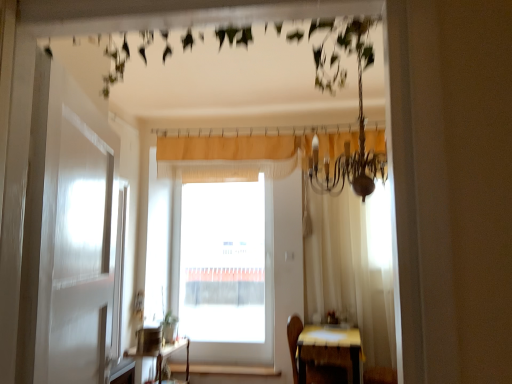
Question: Is transparent glass window at center at the back of wooden at lower center?

Choices:
 (A) yes
 (B) no

Answer: (B)

Question: Is wooden at lower center thinner than transparent glass window at center?

Choices:
 (A) yes
 (B) no

Answer: (B)

Question: From a real-world perspective, is wooden at lower center below transparent glass window at center?

Choices:
 (A) yes
 (B) no

Answer: (A)

Question: Can we say wooden at lower center lies outside transparent glass window at center?

Choices:
 (A) no
 (B) yes

Answer: (B)

Question: Can you confirm if wooden at lower center is smaller than transparent glass window at center?

Choices:
 (A) no
 (B) yes

Answer: (B)

Question: Looking at their shapes, would you say beige textured curtain at center is wider or thinner than wooden table at center, placed as the first table when sorted from left to right?

Choices:
 (A) wide
 (B) thin

Answer: (B)

Question: Is point (370, 144) positioned closer to the camera than point (155, 380)?

Choices:
 (A) farther
 (B) closer

Answer: (B)

Question: Would you say beige textured curtain at center is to the left or to the right of wooden table at center, which appears as the 2th table when viewed from the right, in the picture?

Choices:
 (A) right
 (B) left

Answer: (A)

Question: From a real-world perspective, relative to wooden table at center, which appears as the 2th table when viewed from the right, is beige textured curtain at center vertically above or below?

Choices:
 (A) below
 (B) above

Answer: (B)

Question: Is point (278, 137) positioned closer to the camera than point (245, 370)?

Choices:
 (A) closer
 (B) farther

Answer: (A)

Question: From the image's perspective, is beige textured curtain at center positioned above or below wooden at lower center?

Choices:
 (A) below
 (B) above

Answer: (B)

Question: Which is correct: beige textured curtain at center is inside wooden at lower center, or outside of it?

Choices:
 (A) outside
 (B) inside

Answer: (A)

Question: Considering the positions of beige textured curtain at center and wooden at lower center in the image, is beige textured curtain at center bigger or smaller than wooden at lower center?

Choices:
 (A) big
 (B) small

Answer: (A)

Question: Is wooden table at center, placed as the first table when sorted from left to right, in front of or behind wooden table at lower right, positioned as the 1th table in right-to-left order, in the image?

Choices:
 (A) front
 (B) behind

Answer: (B)

Question: Does point (156, 382) appear closer or farther from the camera than point (300, 342)?

Choices:
 (A) farther
 (B) closer

Answer: (A)